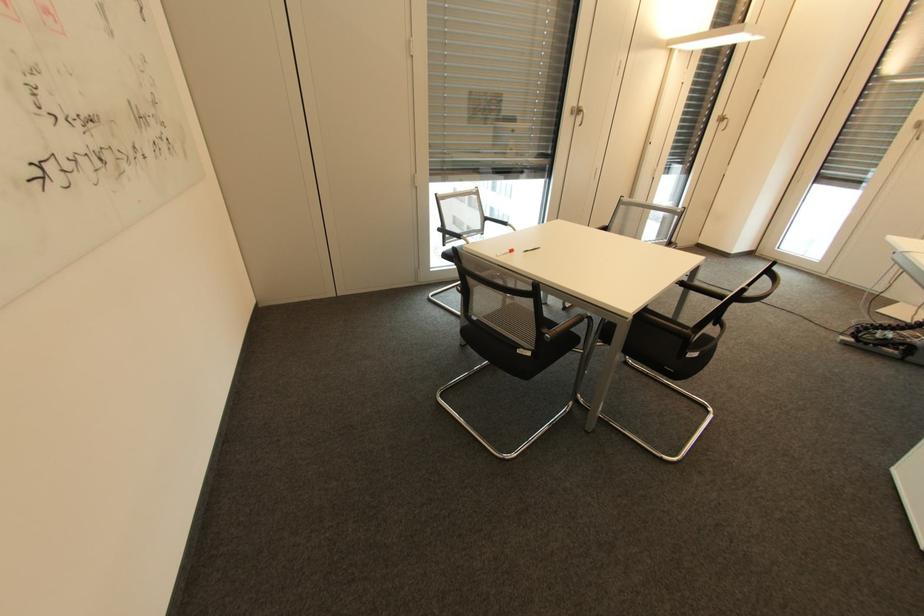
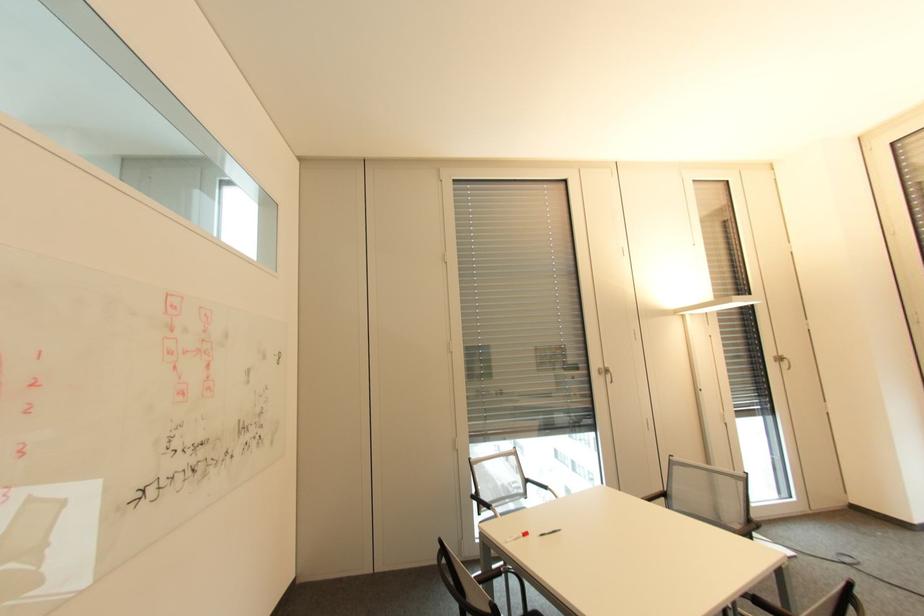
How did the camera likely rotate?

The camera's rotation is toward left-up.